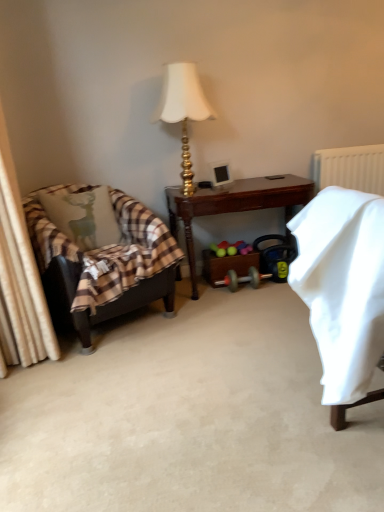
Question: Is light green fabric pillow with deer print at left completely or partially outside of leather armchair at left?

Choices:
 (A) no
 (B) yes

Answer: (A)

Question: From a real-world perspective, is light green fabric pillow with deer print at left on top of leather armchair at left?

Choices:
 (A) yes
 (B) no

Answer: (A)

Question: Is light green fabric pillow with deer print at left to the right of leather armchair at left from the viewer's perspective?

Choices:
 (A) no
 (B) yes

Answer: (A)

Question: Is light green fabric pillow with deer print at left directly adjacent to leather armchair at left?

Choices:
 (A) no
 (B) yes

Answer: (A)

Question: From the image's perspective, is light green fabric pillow with deer print at left below leather armchair at left?

Choices:
 (A) no
 (B) yes

Answer: (A)

Question: Would you say leather armchair at left is part of light green fabric pillow with deer print at left's contents?

Choices:
 (A) yes
 (B) no

Answer: (B)

Question: Considering the relative positions of gold metallic lamp at upper center and white plastic radiator at upper right in the image provided, is gold metallic lamp at upper center to the right of white plastic radiator at upper right from the viewer's perspective?

Choices:
 (A) yes
 (B) no

Answer: (B)

Question: Is gold metallic lamp at upper center wider than white plastic radiator at upper right?

Choices:
 (A) no
 (B) yes

Answer: (B)

Question: Can you confirm if gold metallic lamp at upper center is shorter than white plastic radiator at upper right?

Choices:
 (A) no
 (B) yes

Answer: (A)

Question: From the image's perspective, would you say gold metallic lamp at upper center is positioned over white plastic radiator at upper right?

Choices:
 (A) yes
 (B) no

Answer: (A)

Question: Would you consider gold metallic lamp at upper center to be distant from white plastic radiator at upper right?

Choices:
 (A) no
 (B) yes

Answer: (B)

Question: Can you confirm if gold metallic lamp at upper center is positioned to the left of white plastic radiator at upper right?

Choices:
 (A) yes
 (B) no

Answer: (A)

Question: Is gold metallic lamp at upper center further to the viewer compared to leather armchair at left?

Choices:
 (A) yes
 (B) no

Answer: (A)